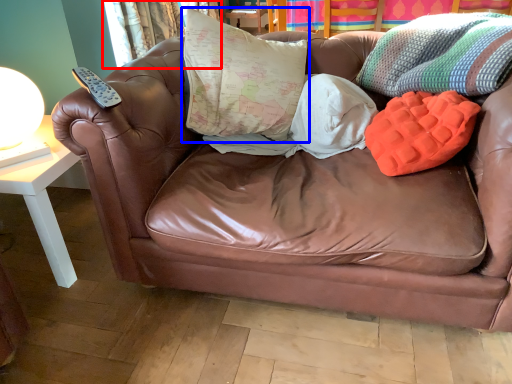
Question: Which object appears farthest to the camera in this image, curtain (highlighted by a red box) or pillow (highlighted by a blue box)?

Choices:
 (A) curtain
 (B) pillow

Answer: (A)